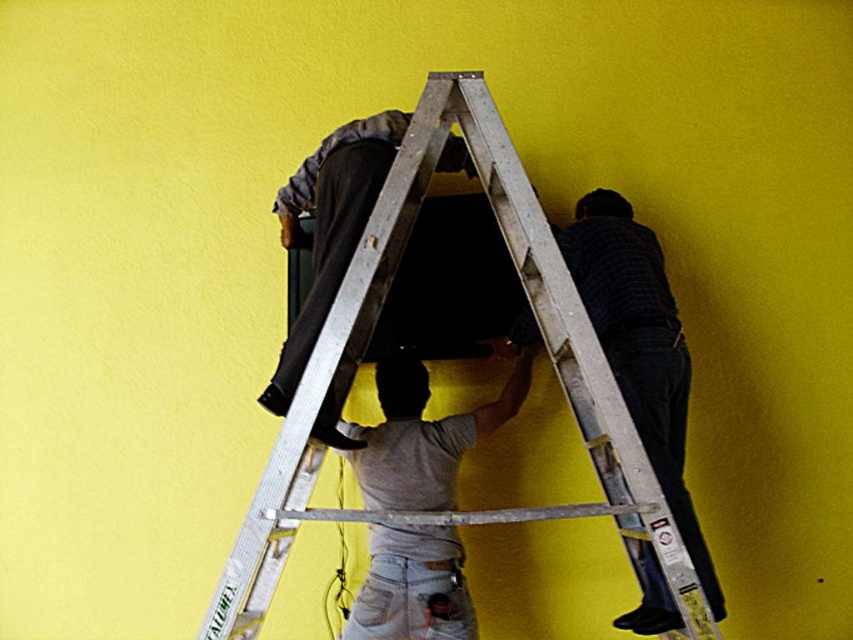
You are trying to determine if the silver metallic ladder at center can fit through a doorway that is the same width as the gray matte fabric at center. Can it fit?

The silver metallic ladder at center might be wider than gray matte fabric at center, so it may not fit through the doorway if the doorway is the same width as the gray matte fabric at center.

You are a safety inspector observing the scene. The gray matte fabric at center is a protective covering for the floor. Is the silver metallic ladder at center positioned safely above it to prevent damage?

The silver metallic ladder at center is above the gray matte fabric at center, so it is positioned safely to prevent damage to the floor covering.

You are a painter trying to paint the wall behind the silver metallic ladder at center and the matte black tv at center. The ladder is 10.65 inches away from the TV. If your spray can has a range of 10 inches, can you reach the wall behind the TV without moving the ladder?

The silver metallic ladder at center is 10.65 inches from the matte black tv at center. Since the spray can only reaches 10 inches, you cannot reach the wall behind the TV without moving the ladder because the distance is greater than the spray can range.